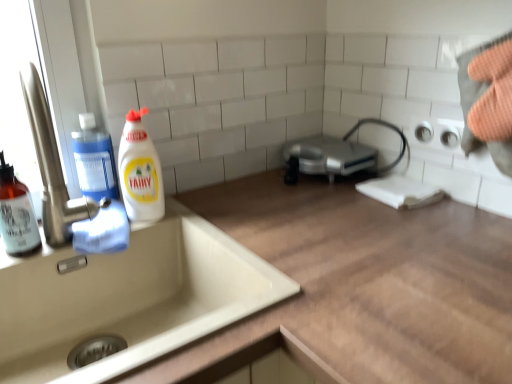
Question: From a real-world perspective, does transparent plastic soap dispenser at left, which is the second cleaning product from right to left, stand above translucent amber bottle at left, the 1th cleaning product when ordered from left to right?

Choices:
 (A) yes
 (B) no

Answer: (A)

Question: From a real-world perspective, does transparent plastic soap dispenser at left, the 2th cleaning product when ordered from left to right, sit lower than translucent amber bottle at left, which is the third cleaning product in right-to-left order?

Choices:
 (A) no
 (B) yes

Answer: (A)

Question: Is transparent plastic soap dispenser at left, which is the second cleaning product from right to left, positioned far away from translucent amber bottle at left, which is the third cleaning product in right-to-left order?

Choices:
 (A) no
 (B) yes

Answer: (A)

Question: Is transparent plastic soap dispenser at left, which is the second cleaning product from right to left, wider than translucent amber bottle at left, which is the third cleaning product in right-to-left order?

Choices:
 (A) no
 (B) yes

Answer: (A)

Question: Is transparent plastic soap dispenser at left, the 2th cleaning product when ordered from left to right, to the right of translucent amber bottle at left, the 1th cleaning product when ordered from left to right, from the viewer's perspective?

Choices:
 (A) no
 (B) yes

Answer: (B)

Question: Considering the positions of point (98, 145) and point (138, 112), is point (98, 145) closer or farther from the camera than point (138, 112)?

Choices:
 (A) closer
 (B) farther

Answer: (B)

Question: Is transparent plastic soap dispenser at left, the 2th cleaning product when ordered from left to right, situated inside white glossy bottle at left, which appears as the first cleaning product when viewed from the right, or outside?

Choices:
 (A) outside
 (B) inside

Answer: (A)

Question: From the image's perspective, is transparent plastic soap dispenser at left, the 2th cleaning product when ordered from left to right, positioned above or below white glossy bottle at left, which appears as the first cleaning product when viewed from the right?

Choices:
 (A) below
 (B) above

Answer: (B)

Question: Is transparent plastic soap dispenser at left, which is the second cleaning product from right to left, wider or thinner than white glossy bottle at left, which appears as the first cleaning product when viewed from the right?

Choices:
 (A) thin
 (B) wide

Answer: (A)

Question: Is point (84, 112) closer or farther from the camera than point (83, 269)?

Choices:
 (A) closer
 (B) farther

Answer: (B)

Question: Based on their sizes in the image, would you say transparent plastic soap dispenser at left, the 2th cleaning product when ordered from left to right, is bigger or smaller than beige ceramic sink at lower left?

Choices:
 (A) small
 (B) big

Answer: (A)

Question: Is transparent plastic soap dispenser at left, the 2th cleaning product when ordered from left to right, in front of or behind beige ceramic sink at lower left in the image?

Choices:
 (A) front
 (B) behind

Answer: (B)

Question: From the image's perspective, is transparent plastic soap dispenser at left, which is the second cleaning product from right to left, located above or below beige ceramic sink at lower left?

Choices:
 (A) above
 (B) below

Answer: (A)

Question: In the image, is translucent amber bottle at left, the 1th cleaning product when ordered from left to right, on the left side or the right side of white glossy bottle at left, the third cleaning product viewed from the left?

Choices:
 (A) left
 (B) right

Answer: (A)

Question: Is translucent amber bottle at left, the 1th cleaning product when ordered from left to right, spatially inside white glossy bottle at left, which appears as the first cleaning product when viewed from the right, or outside of it?

Choices:
 (A) inside
 (B) outside

Answer: (B)